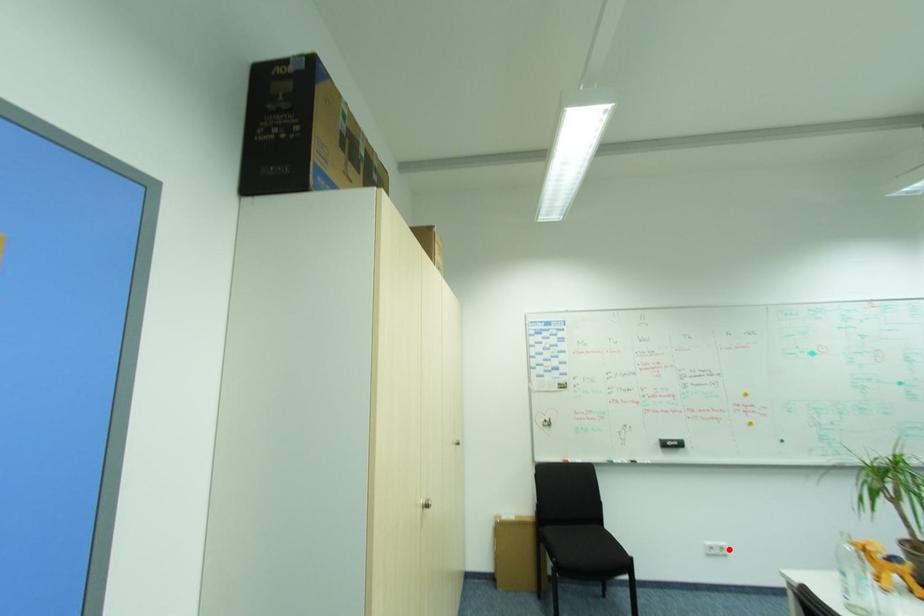
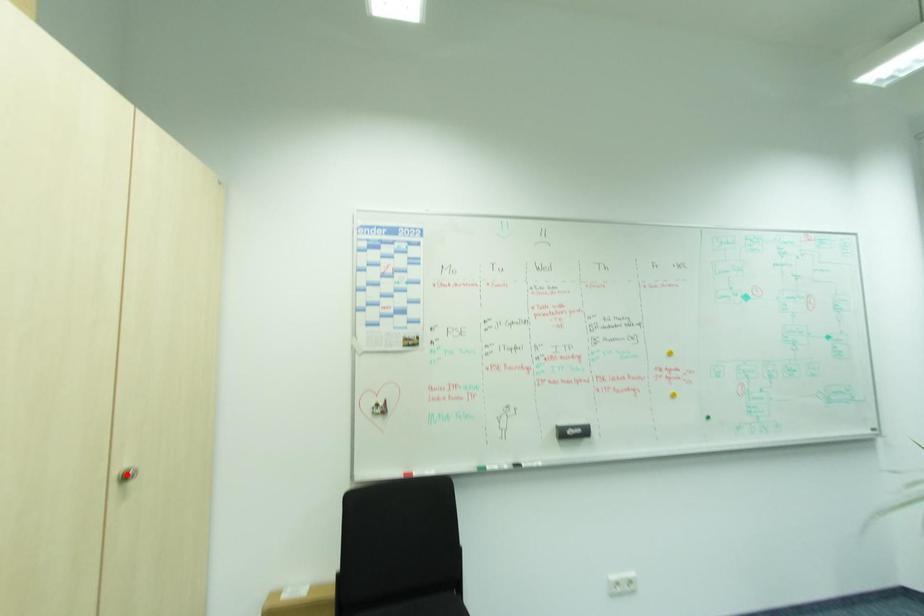
I am providing you with two images of the same scene from different viewpoints. A red point is marked on the first image and another point is marked on the second image. Do the highlighted points in image1 and image2 indicate the same real-world spot?

No